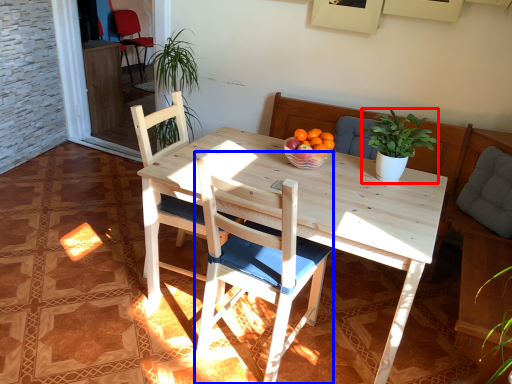
Question: Among these objects, which one is farthest to the camera, houseplant (highlighted by a red box) or chair (highlighted by a blue box)?

Choices:
 (A) houseplant
 (B) chair

Answer: (A)